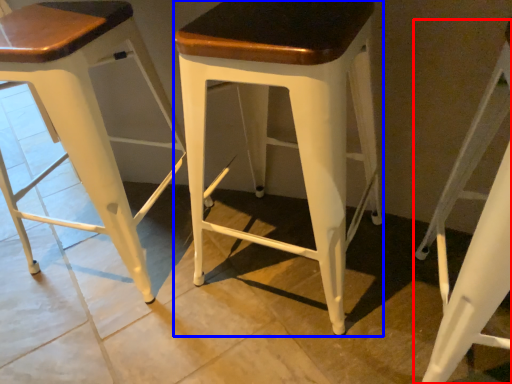
Question: Among these objects, which one is nearest to the camera, stool (highlighted by a red box) or stool (highlighted by a blue box)?

Choices:
 (A) stool
 (B) stool

Answer: (A)